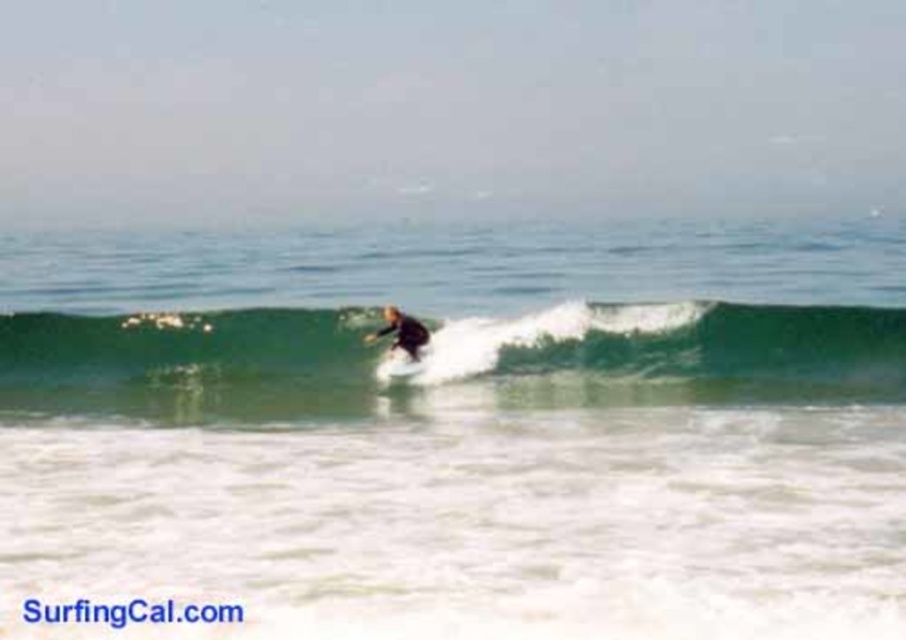
You are a drone operator trying to capture the surfer in the image. You have two points marked on your screen for camera positioning. The first point is point (x=408, y=342) and the second is point (x=410, y=371). If you want to position the camera to focus on the surfer who is between these two points, which point should you place closer to the camera to ensure the surfer is centered?

Point (x=410, y=371) should be placed closer to the camera because point (x=408, y=342) is behind point (x=410, y=371), meaning the surfer is closer to point (x=410, y=371).

You are a photographer standing on the beach and want to capture the surfer and the wave in the image. Which object is closer to you between the green rubber wave at center and the white foam surfboard at center?

The green rubber wave at center is closer to the viewer than the white foam surfboard at center.

Based on the photo, you are standing on the beach and see the surfer at point (394,324) in the image. If you want to throw a lifebuoy to the surfer, will it reach them? Assume the lifebuoy can travel 40 meters.

The distance between you and the surfer at point (394,324) is 38.40 meters, so yes, the lifebuoy can reach them since it can travel 40 meters.